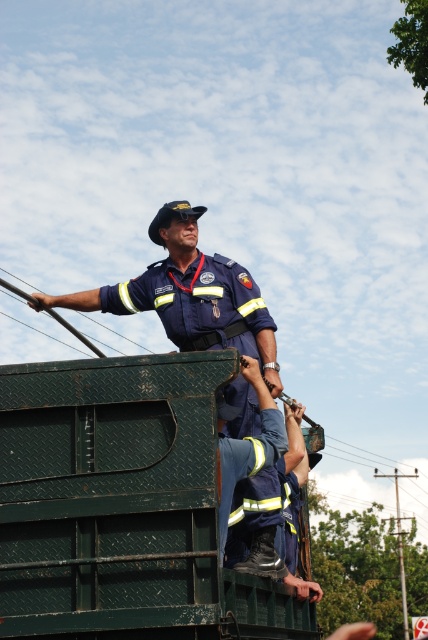
Who is more forward, [262,624] or [207,301]?

Point [262,624] is in front.

At what (x,y) coordinates should I click in order to perform the action: click on green diamond plate garbage truck at upper center. Please return your answer as a coordinate pair (x, y). Looking at the image, I should click on (124, 506).